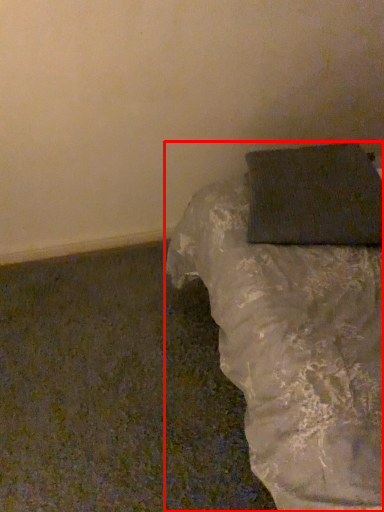
Question: From the image's perspective, where is furniture (annotated by the red box) located in relation to wrapping paper in the image?

Choices:
 (A) below
 (B) above

Answer: (A)